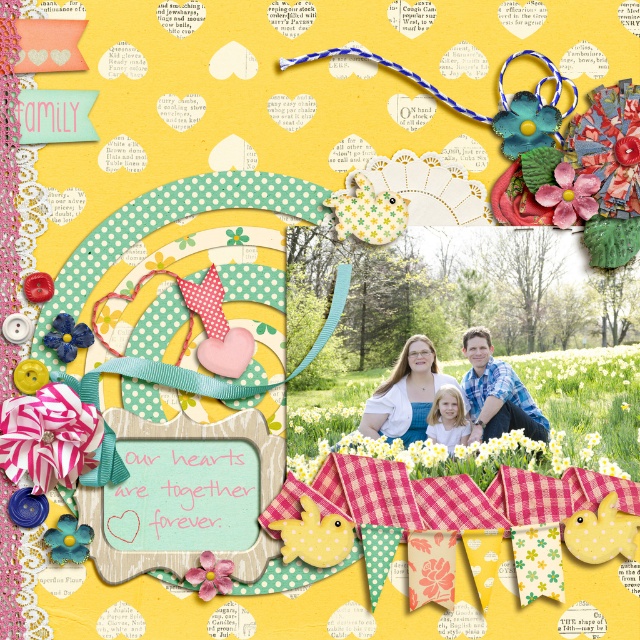
Question: From the image, what is the correct spatial relationship of pink fabric flower at lower left in relation to blue plaid shirt at center?

Choices:
 (A) right
 (B) left

Answer: (B)

Question: Which point is farther to the camera?

Choices:
 (A) pink glossy flower at center
 (B) white paper flower at center

Answer: (B)

Question: Which object is farther from the camera taking this photo?

Choices:
 (A) pink fabric flower at center
 (B) pink glossy flower at center
 (C) blue denim jeans at center
 (D) white paper flower at center

Answer: (C)

Question: Does white paper flower at center have a larger size compared to pink glossy flower at center?

Choices:
 (A) no
 (B) yes

Answer: (B)

Question: Which of the following is the farthest from the observer?

Choices:
 (A) (387, 401)
 (B) (586, 458)
 (C) (547, 433)
 (D) (522, 422)

Answer: (A)

Question: Is pink fabric flower at center in front of pink glossy flower at center?

Choices:
 (A) yes
 (B) no

Answer: (B)